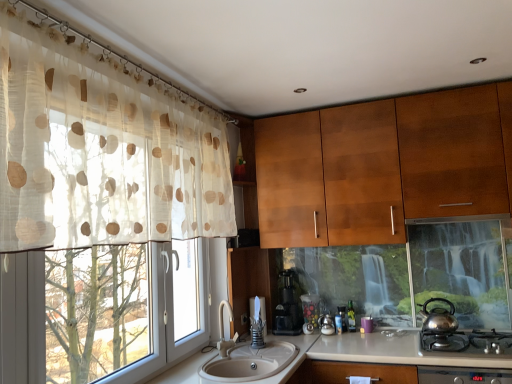
Question: Should I look upward or downward to see translucent plastic jar at center, marked as the first appliance in a left-to-right arrangement?

Choices:
 (A) down
 (B) up

Answer: (A)

Question: Can you confirm if black plastic coffee machine at center is bigger than translucent plastic jar at center, marked as the first appliance in a left-to-right arrangement?

Choices:
 (A) yes
 (B) no

Answer: (A)

Question: Is black plastic coffee machine at center behind translucent plastic jar at center, the 2th appliance positioned from the right?

Choices:
 (A) no
 (B) yes

Answer: (A)

Question: Can you see black plastic coffee machine at center touching translucent plastic jar at center, the 2th appliance positioned from the right?

Choices:
 (A) yes
 (B) no

Answer: (B)

Question: Is black plastic coffee machine at center wider than translucent plastic jar at center, marked as the first appliance in a left-to-right arrangement?

Choices:
 (A) yes
 (B) no

Answer: (A)

Question: Is black plastic coffee machine at center aimed at translucent plastic jar at center, the 2th appliance positioned from the right?

Choices:
 (A) no
 (B) yes

Answer: (A)

Question: From the image's perspective, is black plastic coffee machine at center on translucent plastic jar at center, the 2th appliance positioned from the right?

Choices:
 (A) yes
 (B) no

Answer: (A)

Question: Would you say beige ceramic sink at lower center contains black plastic coffee machine at center?

Choices:
 (A) yes
 (B) no

Answer: (B)

Question: Does beige ceramic sink at lower center have a larger size compared to black plastic coffee machine at center?

Choices:
 (A) no
 (B) yes

Answer: (B)

Question: From a real-world perspective, is beige ceramic sink at lower center located higher than black plastic coffee machine at center?

Choices:
 (A) yes
 (B) no

Answer: (B)

Question: Is beige ceramic sink at lower center oriented away from black plastic coffee machine at center?

Choices:
 (A) yes
 (B) no

Answer: (B)

Question: Considering the relative sizes of beige ceramic sink at lower center and black plastic coffee machine at center in the image provided, is beige ceramic sink at lower center wider than black plastic coffee machine at center?

Choices:
 (A) yes
 (B) no

Answer: (A)

Question: Does beige ceramic sink at lower center have a lesser height compared to black plastic coffee machine at center?

Choices:
 (A) no
 (B) yes

Answer: (B)

Question: Does polished stainless steel kettle at lower right turn towards shiny metallic teapot at right?

Choices:
 (A) no
 (B) yes

Answer: (A)